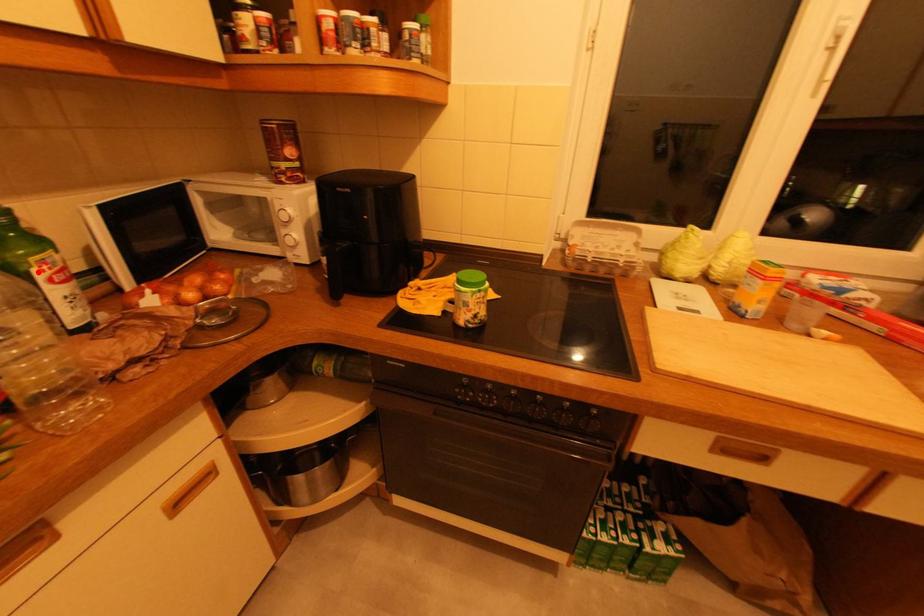
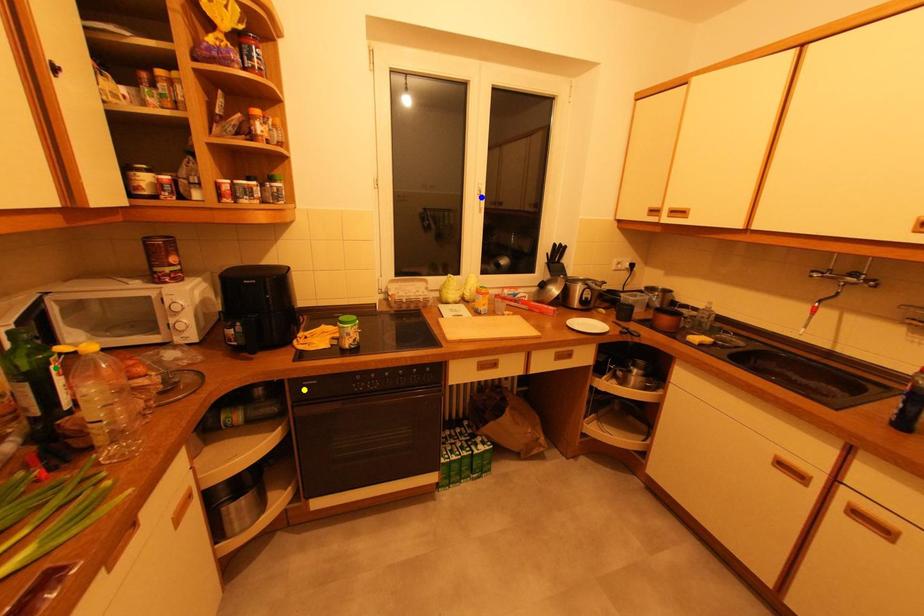
Question: I am providing you with two images of the same scene from different viewpoints. A red point is marked on the first image. You are given multiple points on the second image. Can you choose the point in image 2 that corresponds to the point in image 1?

Choices:
 (A) blue point
 (B) green point
 (C) yellow point

Answer: (B)